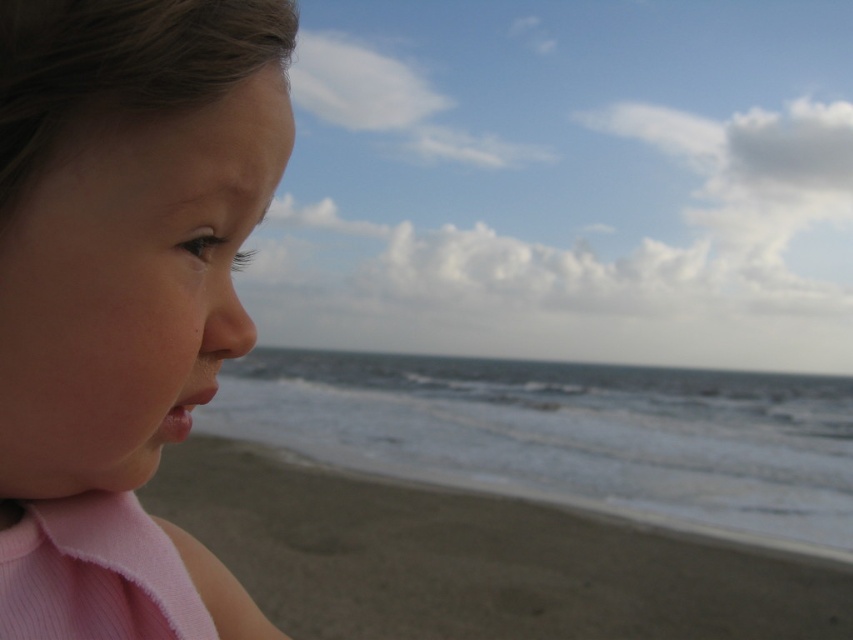
Measure the distance between point [62,54] and camera.

28.82 centimeters

Is point (79, 465) farther from camera compared to point (532, 580)?

No, it is in front of (532, 580).

Locate an element on the screen. This screenshot has height=640, width=853. pink fabric at left is located at coordinates (123, 294).